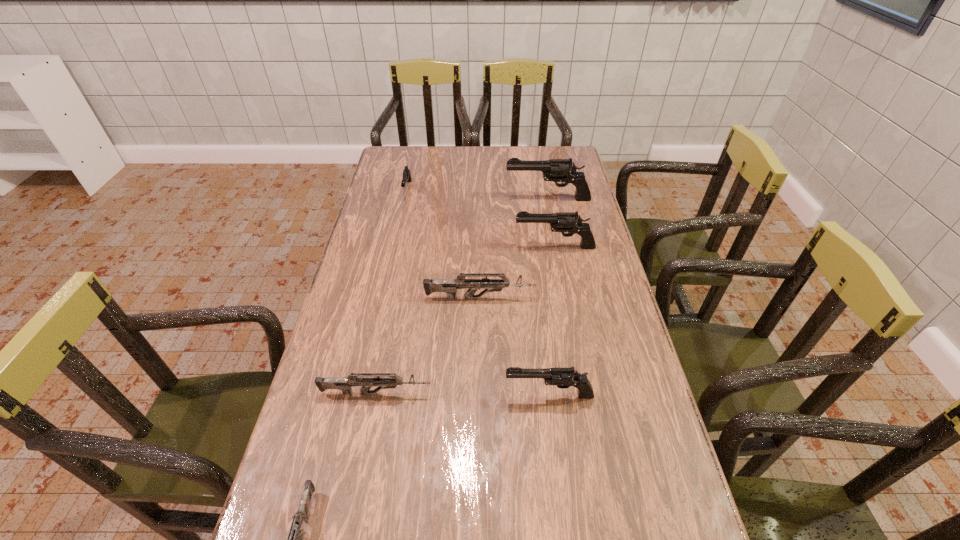
Identify the location of vacant space situated 0.210m at the end of the barrel of the biggest black gun. (450, 199).

At what (x,y) coordinates should I click in order to perform the action: click on vacant area situated at the end of the barrel of the biggest black gun. Please return your answer as a coordinate pair (x, y). Image resolution: width=960 pixels, height=540 pixels. Looking at the image, I should click on (450, 199).

This screenshot has height=540, width=960. I want to click on free space located at the end of the barrel of the third smallest black gun, so click(x=400, y=247).

Identify the location of vacant space located 0.290m at the end of the barrel of the third smallest black gun. (427, 247).

Identify the location of free spot located 0.170m at the end of the barrel of the third smallest black gun. The height and width of the screenshot is (540, 960). (464, 247).

Locate an element on the screen. vacant space located at the end of the barrel of the nearest black gun is located at coordinates 451,395.

Locate an element on the screen. The width and height of the screenshot is (960, 540). vacant area situated 0.290m at the end of the barrel of the nearest black gun is located at coordinates (386, 395).

Image resolution: width=960 pixels, height=540 pixels. Find the location of `vacant space located 0.380m at the end of the barrel of the nearest black gun`. vacant space located 0.380m at the end of the barrel of the nearest black gun is located at coordinates (348, 395).

This screenshot has width=960, height=540. Identify the location of vacant space located 0.090m aimed along the barrel of the farthest grey gun. (564, 298).

You are a GUI agent. You are given a task and a screenshot of the screen. Output one action in this format:
    pyautogui.click(x=<x>, y=<y>)
    Task: Click on the blank space located at the end of the barrel of the smallest black gun
    
    Given the screenshot: What is the action you would take?
    (x=393, y=260)